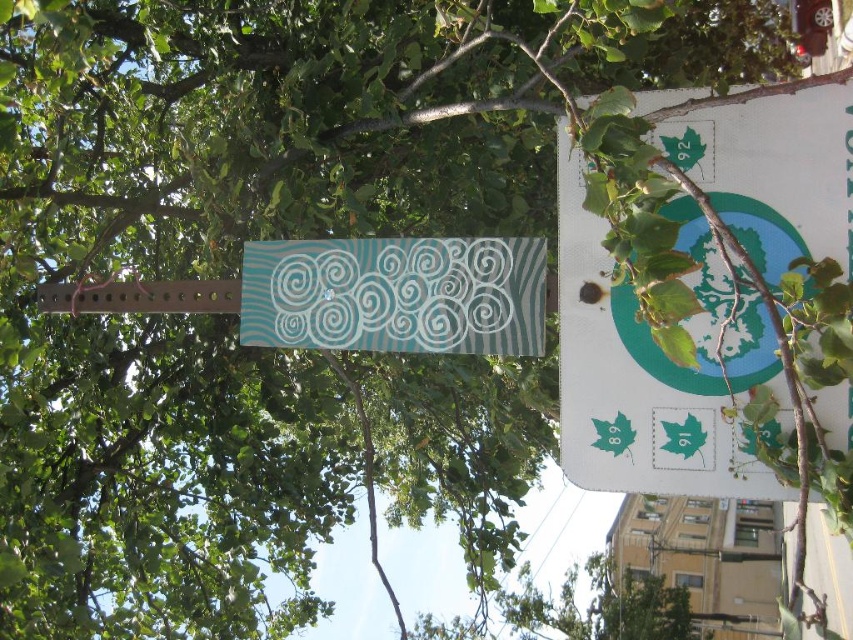
Question: Which point is closer to the camera?

Choices:
 (A) teal matte sign at center
 (B) white paper sign at upper right

Answer: (B)

Question: Which point appears closest to the camera in this image?

Choices:
 (A) (397, 282)
 (B) (657, 387)

Answer: (B)

Question: Can you confirm if white paper sign at upper right is positioned above teal matte sign at center?

Choices:
 (A) no
 (B) yes

Answer: (B)

Question: Considering the relative positions of white paper sign at upper right and teal matte sign at center in the image provided, where is white paper sign at upper right located with respect to teal matte sign at center?

Choices:
 (A) below
 (B) above

Answer: (B)

Question: From the image, what is the correct spatial relationship of white paper sign at upper right in relation to teal matte sign at center?

Choices:
 (A) right
 (B) left

Answer: (A)

Question: Which point appears closest to the camera in this image?

Choices:
 (A) tap(618, 448)
 (B) tap(381, 321)

Answer: (A)